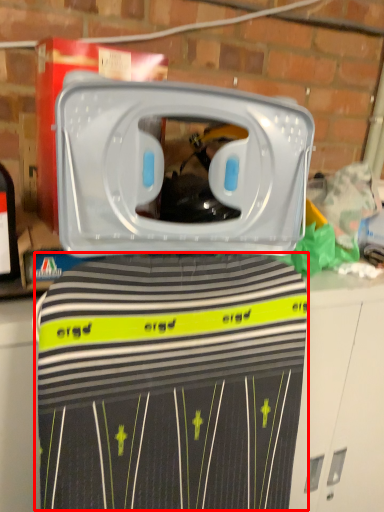
Question: In this image, where is clothing (annotated by the red box) located relative to home appliance?

Choices:
 (A) right
 (B) left

Answer: (A)